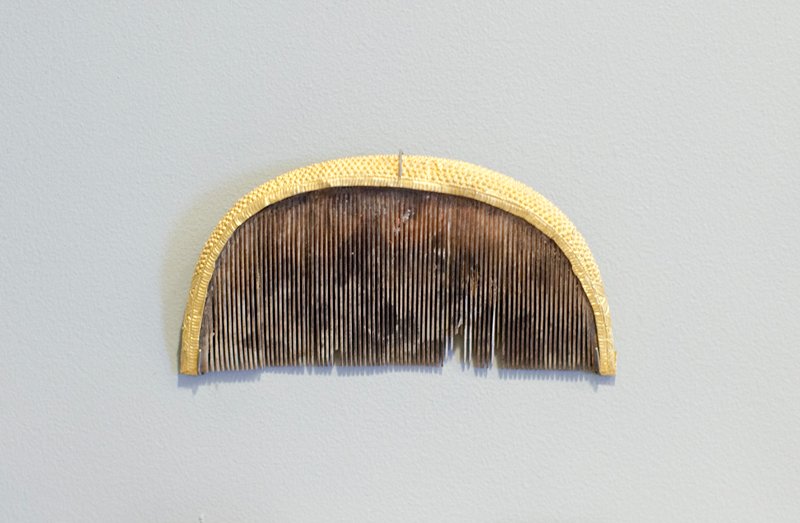
I want to click on table, so click(x=484, y=466).